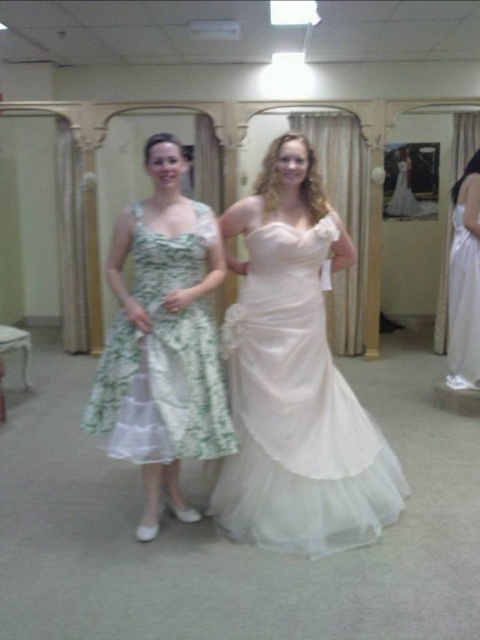
Is satin white dress at center bigger than white satin dress at right?

Indeed, satin white dress at center has a larger size compared to white satin dress at right.

Who is shorter, satin white dress at center or white satin dress at right?

satin white dress at center is shorter.

Locate an element on the screen. Image resolution: width=480 pixels, height=640 pixels. satin white dress at center is located at coordinates (297, 412).

Between green floral fabric dress at center and white satin dress at right, which one appears on the right side from the viewer's perspective?

Positioned to the right is white satin dress at right.

Does green floral fabric dress at center appear on the right side of white satin dress at right?

No, green floral fabric dress at center is not to the right of white satin dress at right.

Who is more distant from viewer, (x=182, y=420) or (x=456, y=232)?

The point (x=456, y=232) is behind.

You are a GUI agent. You are given a task and a screenshot of the screen. Output one action in this format:
    pyautogui.click(x=<x>, y=<y>)
    Task: Click on the green floral fabric dress at center
    The image size is (480, 640).
    Given the screenshot: What is the action you would take?
    pyautogui.click(x=164, y=356)

Can you confirm if satin white dress at center is positioned to the right of green floral fabric dress at center?

Correct, you'll find satin white dress at center to the right of green floral fabric dress at center.

From the picture: Is satin white dress at center wider than green floral fabric dress at center?

Correct, the width of satin white dress at center exceeds that of green floral fabric dress at center.

Locate an element on the screen. Image resolution: width=480 pixels, height=640 pixels. satin white dress at center is located at coordinates (297, 412).